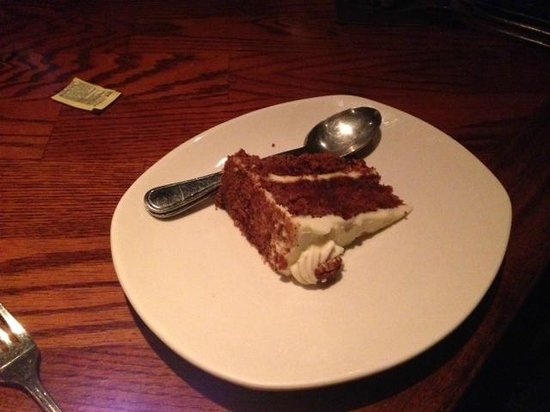
I want to click on fork, so click(16, 358).